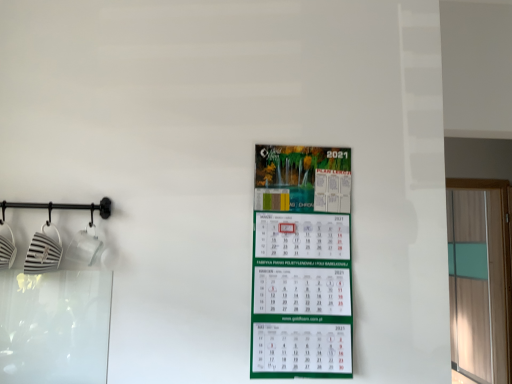
Question: Relative to green matte calendar at center, is transparent glass door at right in front or behind?

Choices:
 (A) behind
 (B) front

Answer: (A)

Question: From a real-world perspective, is transparent glass door at right physically located above or below green matte calendar at center?

Choices:
 (A) above
 (B) below

Answer: (B)

Question: Considering the positions of transparent glass door at right and green matte calendar at center in the image, is transparent glass door at right taller or shorter than green matte calendar at center?

Choices:
 (A) short
 (B) tall

Answer: (B)

Question: From a real-world perspective, is green matte calendar at center positioned above or below transparent glass door at right?

Choices:
 (A) below
 (B) above

Answer: (B)

Question: Is point (333, 274) positioned closer to the camera than point (508, 370)?

Choices:
 (A) closer
 (B) farther

Answer: (A)

Question: Is green matte calendar at center to the left or to the right of transparent glass door at right in the image?

Choices:
 (A) right
 (B) left

Answer: (B)

Question: From the image's perspective, relative to transparent glass door at right, is green matte calendar at center above or below?

Choices:
 (A) below
 (B) above

Answer: (B)